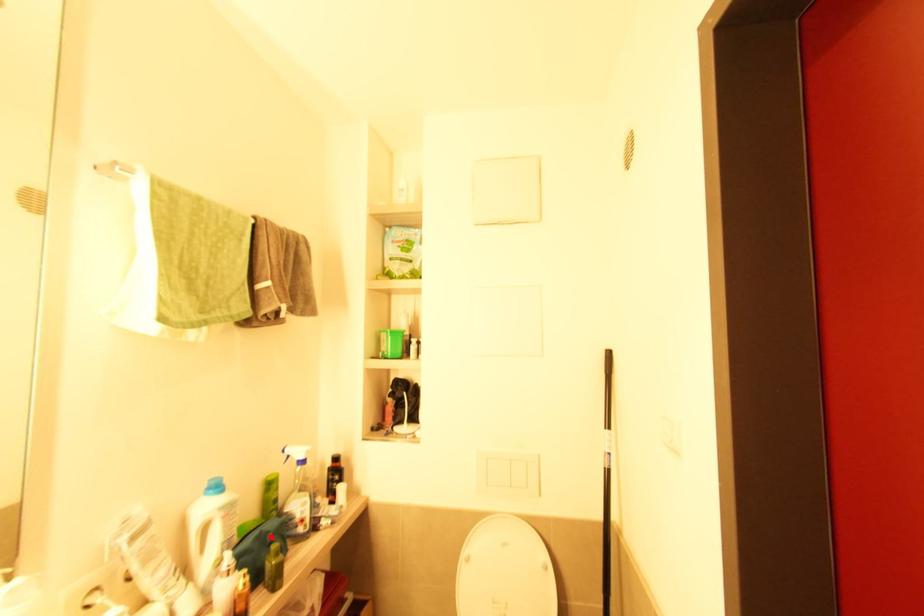
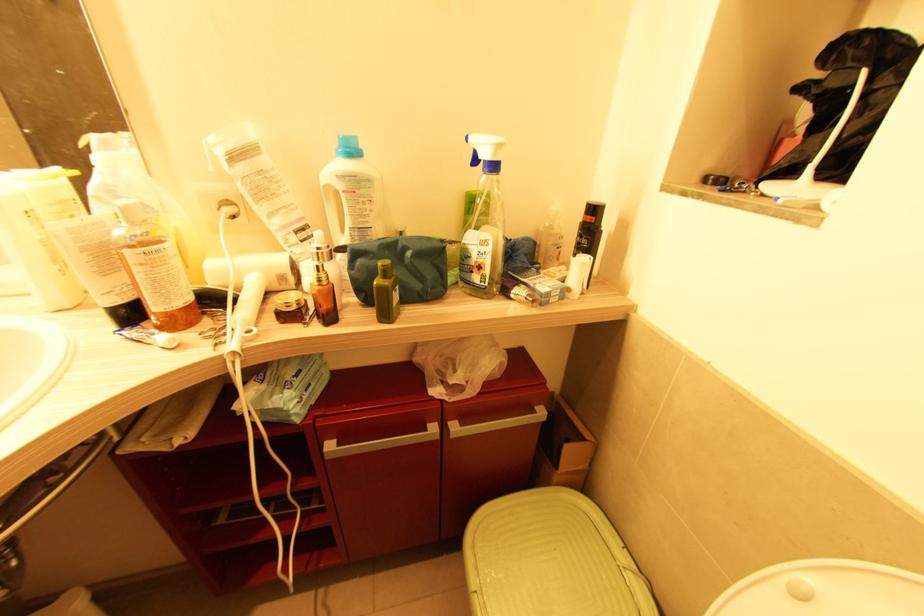
Where in the second image is the point corresponding to the highlighted location from the first image?

(409, 254)